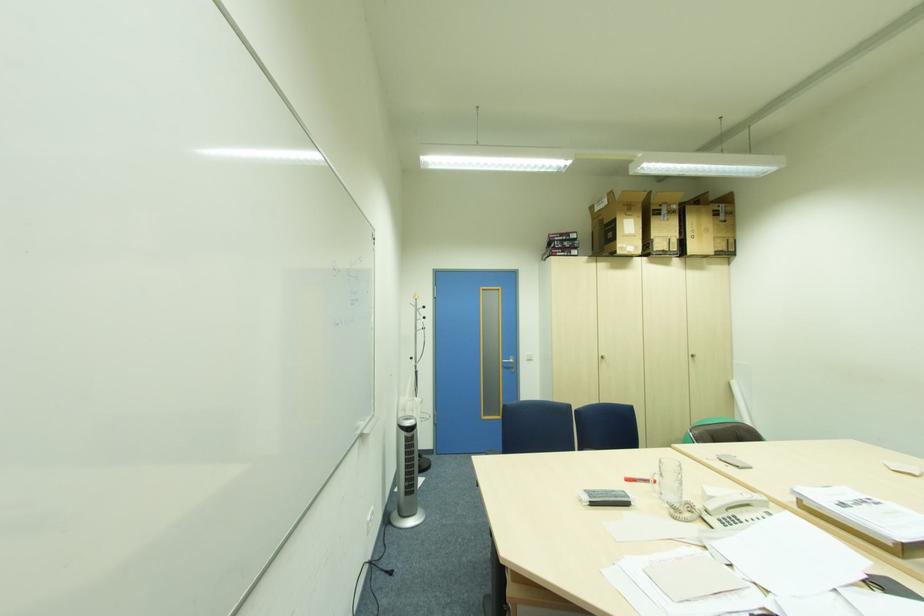
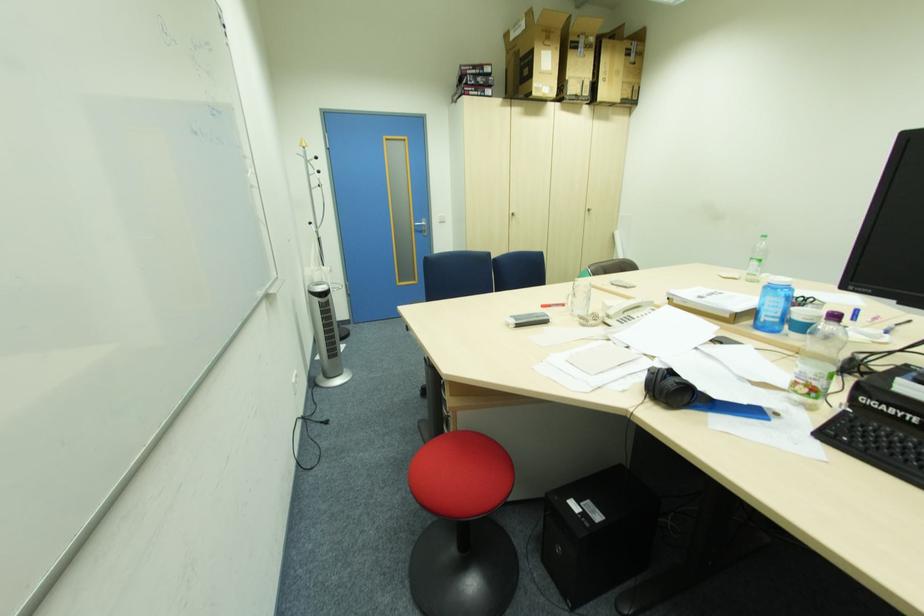
Which direction would the cameraman need to move to produce the second image?

The cameraman walked toward left, forward.